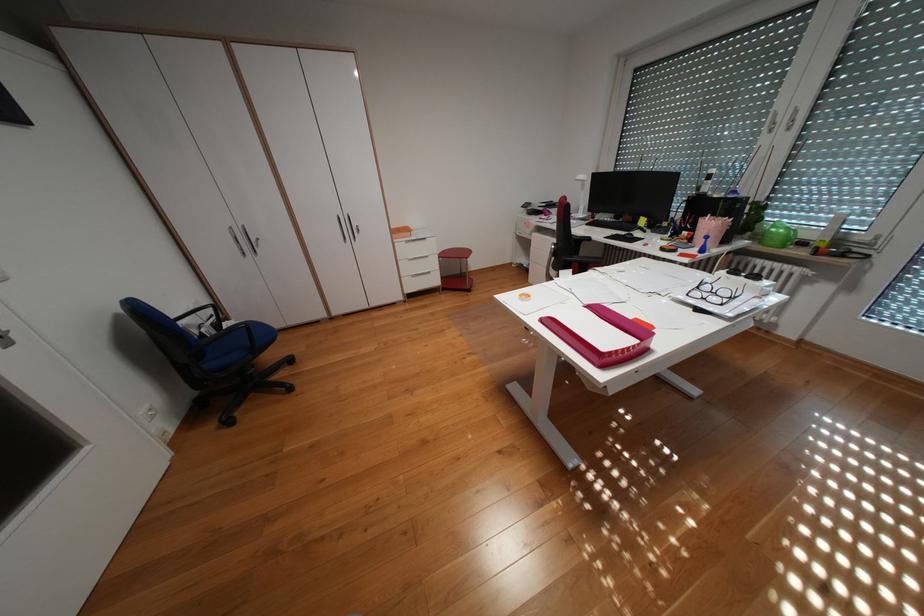
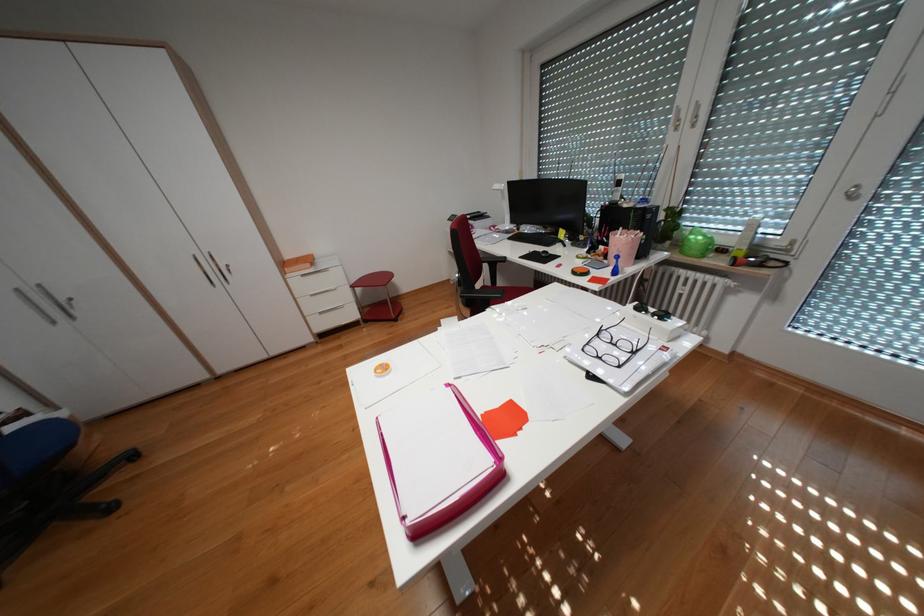
In the second image, find the point that corresponds to (791,119) in the first image.

(695, 116)